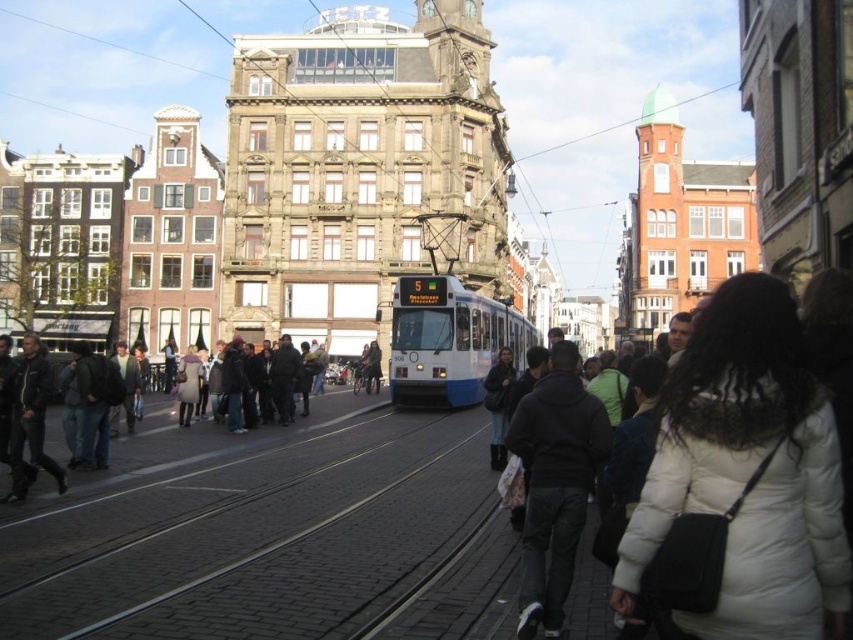
You are a pedestrian standing on the cobblestone street in the scene. You see the white glossy tram at center and the dark blue jacket at center. Which object is taller?

The white glossy tram at center is taller than the dark blue jacket at center.

What are the coordinates of the white glossy tram at center?

The white glossy tram at center is located at coordinates point (448, 340).